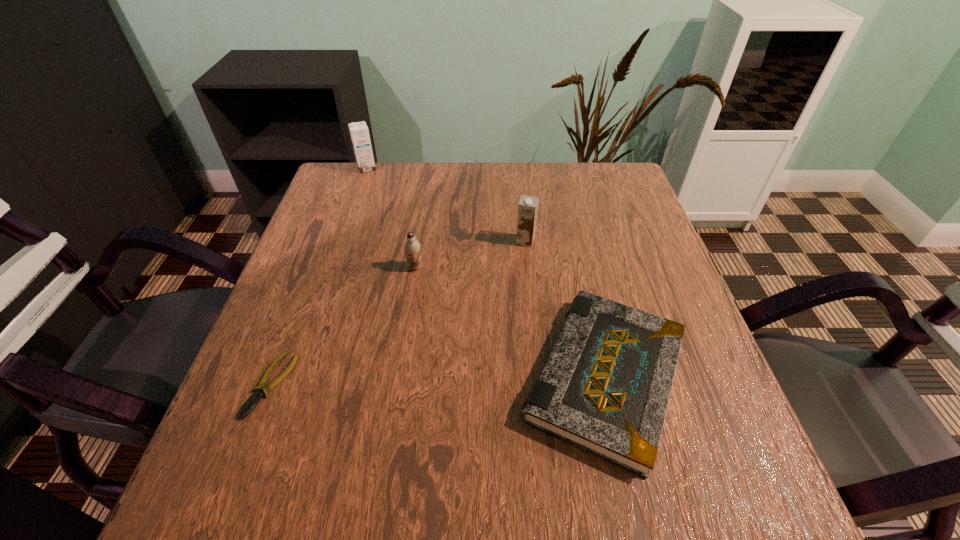
In the image, there is a desktop. Where is `free space at the far edge`? The image size is (960, 540). free space at the far edge is located at coordinates (384, 209).

Where is `vacant area at the near edge`? vacant area at the near edge is located at coordinates (330, 498).

Where is `blank area at the left edge`? This screenshot has height=540, width=960. blank area at the left edge is located at coordinates (228, 436).

Image resolution: width=960 pixels, height=540 pixels. I want to click on free space at the right edge of the desktop, so click(x=610, y=278).

In the image, there is a desktop. Find the location of `vacant space at the near left corner`. vacant space at the near left corner is located at coordinates (263, 463).

Locate an element on the screen. vacant space at the far right corner is located at coordinates (602, 170).

In the image, there is a desktop. Where is `vacant space at the near right corner`? vacant space at the near right corner is located at coordinates (772, 497).

The width and height of the screenshot is (960, 540). I want to click on vacant space that's between the farthest chocolate milk and the second shortest object, so click(x=486, y=273).

The height and width of the screenshot is (540, 960). In order to click on free space that is in between the second chocolate milk from left to right and the rightmost chocolate milk in this screenshot , I will do `click(470, 254)`.

The height and width of the screenshot is (540, 960). What are the coordinates of `empty space between the pliers and the third tallest object` in the screenshot? It's located at (343, 326).